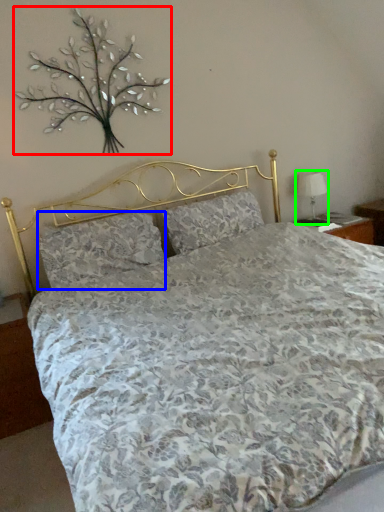
Question: Based on their relative distances, which object is farther from floral arrangement (highlighted by a red box)? Choose from pillow (highlighted by a blue box) and table lamp (highlighted by a green box).

Choices:
 (A) pillow
 (B) table lamp

Answer: (B)